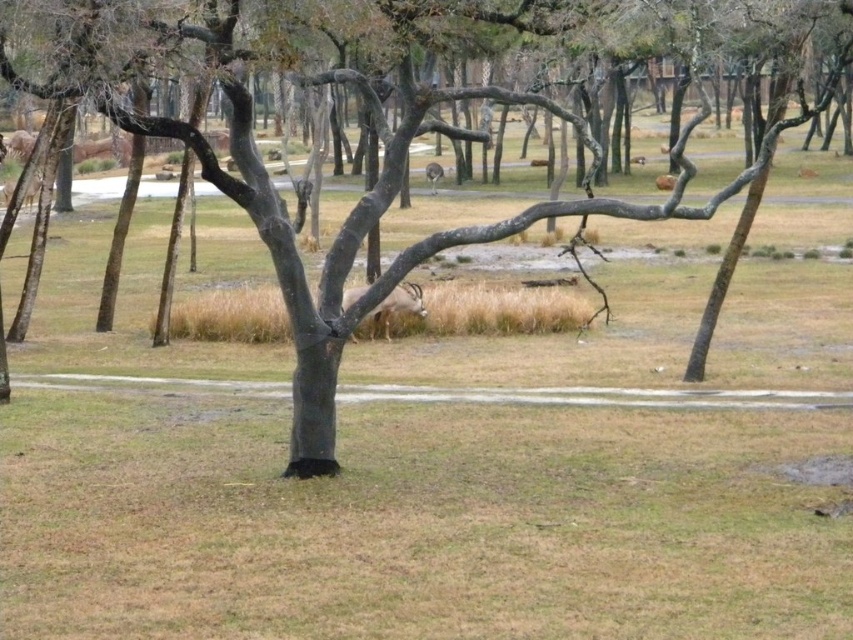
Question: Is brown bark tree at center positioned behind brown fur antelope at center?

Choices:
 (A) yes
 (B) no

Answer: (B)

Question: Does brown bark tree at center appear on the right side of brown furry antelope at center?

Choices:
 (A) no
 (B) yes

Answer: (B)

Question: Which object appears farthest from the camera in this image?

Choices:
 (A) brown bark tree at center
 (B) brown fur antelope at center

Answer: (B)

Question: Which point appears farthest from the camera in this image?

Choices:
 (A) (436, 163)
 (B) (303, 440)

Answer: (A)

Question: Can you confirm if brown bark tree at center is positioned to the right of brown fur antelope at center?

Choices:
 (A) yes
 (B) no

Answer: (A)

Question: Which is nearer to the brown furry antelope at center?

Choices:
 (A) brown fur antelope at center
 (B) brown bark tree at center

Answer: (B)